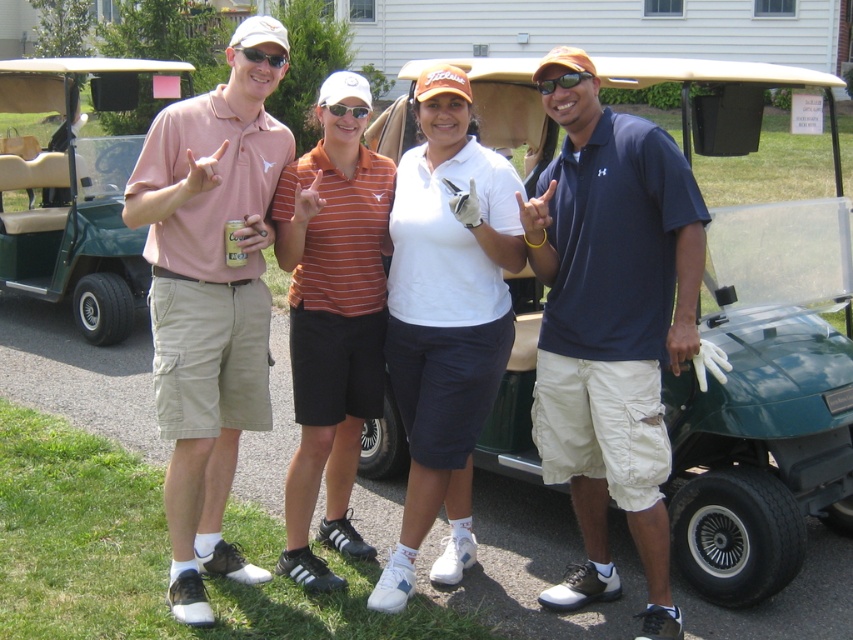
You are a photographer at a golf event and notice the white matte golf glove at center and the orange striped polo shirt at center. Which object is located lower in the image?

The white matte golf glove at center is positioned under the orange striped polo shirt at center, so it is located lower in the image.

You are standing in front of the group of four people in the photo. You notice two points marked at coordinates point (273, 61) and point (352, 115). Which point is closer to you?

Point (273, 61) is closer to the viewer than point (352, 115).

You are a photographer trying to capture a clear shot of both the matte black sunglasses at upper center and the white plastic goggles at center. Which object should you focus on first to ensure both are in frame?

The matte black sunglasses at upper center is shorter than the white plastic goggles at center, so you should focus on the white plastic goggles at center first to ensure both are in frame.